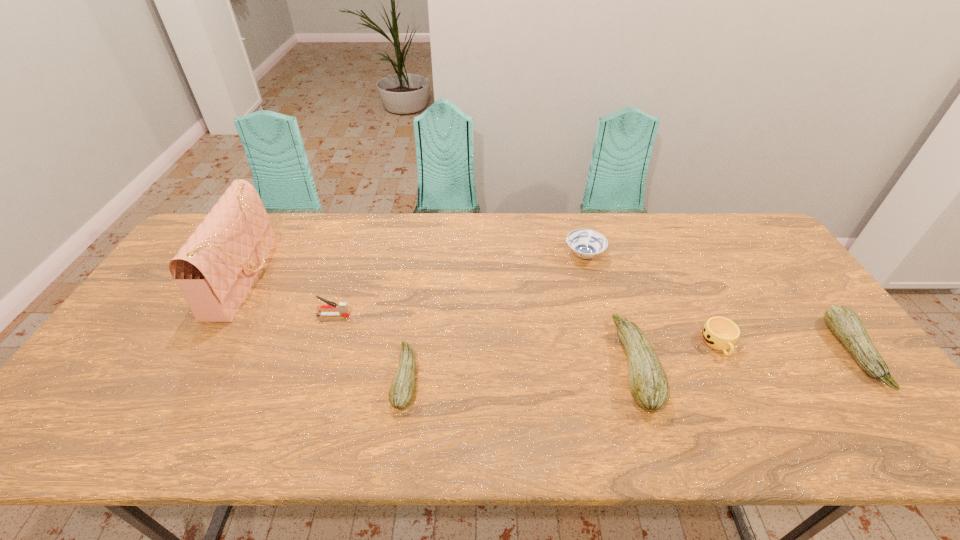
The image size is (960, 540). I want to click on blank area located 0.200m at the stem end of the leftmost zucchini, so click(313, 377).

In order to click on free space located 0.390m at the stem end of the leftmost zucchini in this screenshot , I will do [x=236, y=377].

Locate an element on the screen. The image size is (960, 540). vacant region located 0.230m at the stem end of the leftmost zucchini is located at coordinates (300, 377).

Find the location of `vacant space positioned at the stem end of the second zucchini from left to right`. vacant space positioned at the stem end of the second zucchini from left to right is located at coordinates (535, 364).

Where is `vacant space located at the stem end of the second zucchini from left to right`? The height and width of the screenshot is (540, 960). vacant space located at the stem end of the second zucchini from left to right is located at coordinates (594, 364).

In order to click on free space located at the stem end of the second zucchini from left to right in this screenshot , I will do `click(550, 364)`.

Locate an element on the screen. free point located on the right of the soup bowl is located at coordinates (704, 255).

Locate an element on the screen. free space located on the front-facing side of the handbag is located at coordinates (386, 277).

This screenshot has width=960, height=540. Identify the location of vacant space located on the right of the cup. (845, 344).

You are a GUI agent. You are given a task and a screenshot of the screen. Output one action in this format:
    pyautogui.click(x=<x>, y=<y>)
    Task: Click on the blank space located 0.380m on the handle side of the stapler
    The width and height of the screenshot is (960, 540).
    Given the screenshot: What is the action you would take?
    pyautogui.click(x=486, y=315)